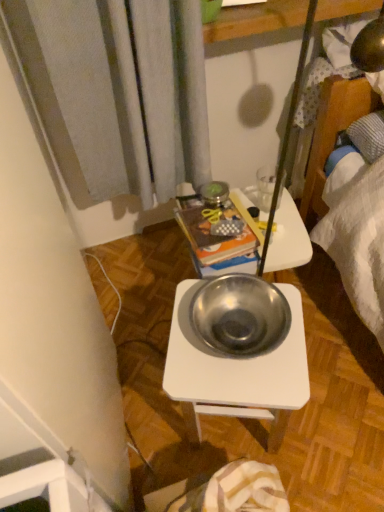
At what (x,y) coordinates should I click in order to perform the action: click on vacant space to the right of metallic white desk at center. Please return your answer as a coordinate pair (x, y). Looking at the image, I should click on (335, 413).